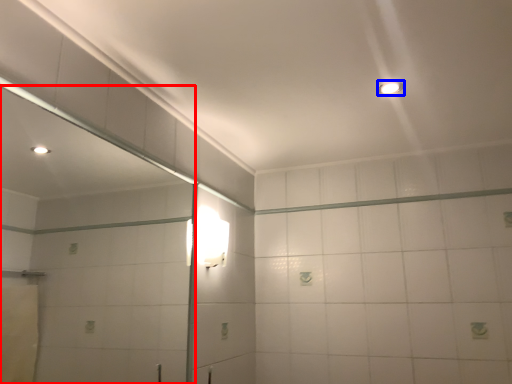
Question: Which object is closer to the camera taking this photo, mirror (highlighted by a red box) or light fixture (highlighted by a blue box)?

Choices:
 (A) mirror
 (B) light fixture

Answer: (A)